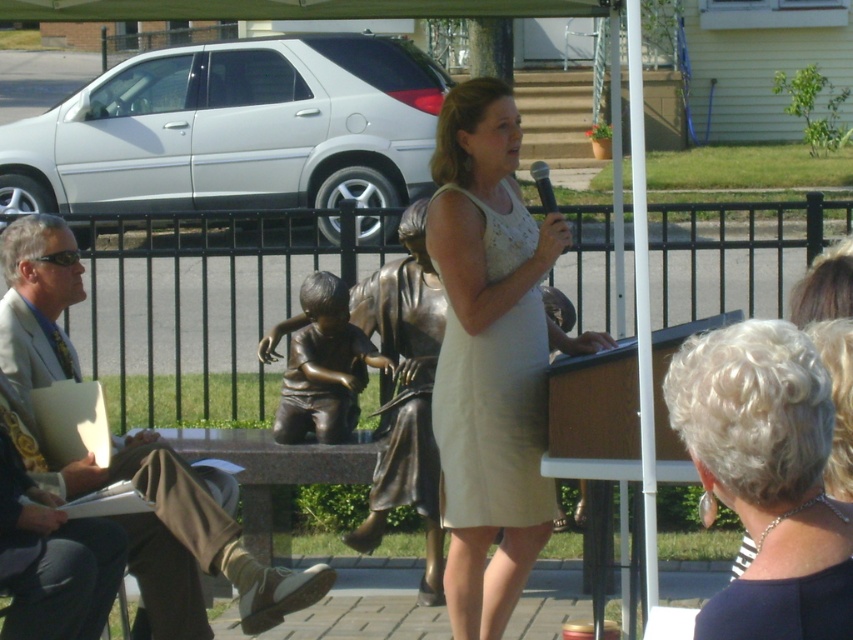
Is point (770, 435) closer to viewer compared to point (152, 579)?

Yes, point (770, 435) is closer to viewer.

From the picture: Is white textured hair at upper right positioned at the back of light brown suit at left?

No, it is not.

The height and width of the screenshot is (640, 853). Find the location of `white textured hair at upper right`. white textured hair at upper right is located at coordinates tap(767, 477).

Between white satin dress at center and light brown suit at left, which one has more height?

Result: Standing taller between the two is white satin dress at center.

Does white satin dress at center come in front of light brown suit at left?

Yes, it is in front of light brown suit at left.

At what (x,y) coordinates should I click in order to perform the action: click on white satin dress at center. Please return your answer as a coordinate pair (x, y). This screenshot has width=853, height=640. Looking at the image, I should click on (490, 356).

Is light brown suit at left thinner than bronze statue at center?

No.

Consider the image. Can you confirm if light brown suit at left is positioned to the left of bronze statue at center?

Indeed, light brown suit at left is positioned on the left side of bronze statue at center.

Which is behind, point (62, 275) or point (357, 355)?

The point (357, 355) is behind.

The image size is (853, 640). In order to click on light brown suit at left in this screenshot , I will do `click(193, 544)`.